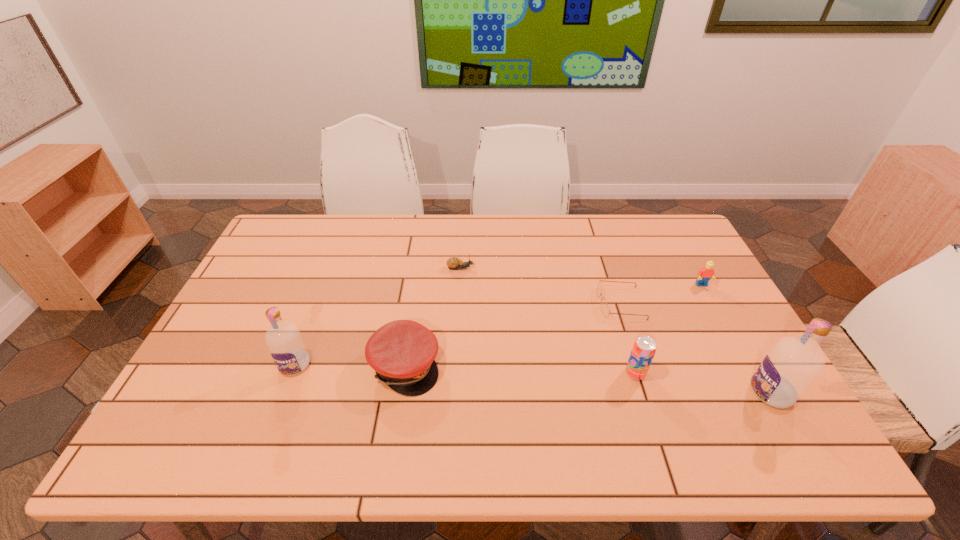
Find the location of a particular element. Image resolution: width=960 pixels, height=540 pixels. vodka that is at the near edge is located at coordinates (793, 363).

The height and width of the screenshot is (540, 960). Identify the location of cap that is at the near edge. (402, 352).

At what (x,y) coordinates should I click in order to perform the action: click on vodka positioned at the right edge. Please return your answer as a coordinate pair (x, y). Looking at the image, I should click on (793, 363).

Find the location of a particular element. Lego present at the right edge is located at coordinates (704, 275).

Find the location of a particular element. The height and width of the screenshot is (540, 960). object located in the near right corner section of the desktop is located at coordinates (793, 363).

The height and width of the screenshot is (540, 960). Identify the location of free space at the far edge. (354, 241).

Where is `free spot at the near edge of the desktop`? free spot at the near edge of the desktop is located at coordinates (300, 406).

The height and width of the screenshot is (540, 960). Find the location of `free space at the left edge of the desktop`. free space at the left edge of the desktop is located at coordinates (224, 321).

This screenshot has height=540, width=960. I want to click on free space at the right edge, so click(716, 286).

The height and width of the screenshot is (540, 960). In order to click on free region at the far left corner of the desktop in this screenshot , I will do `click(310, 233)`.